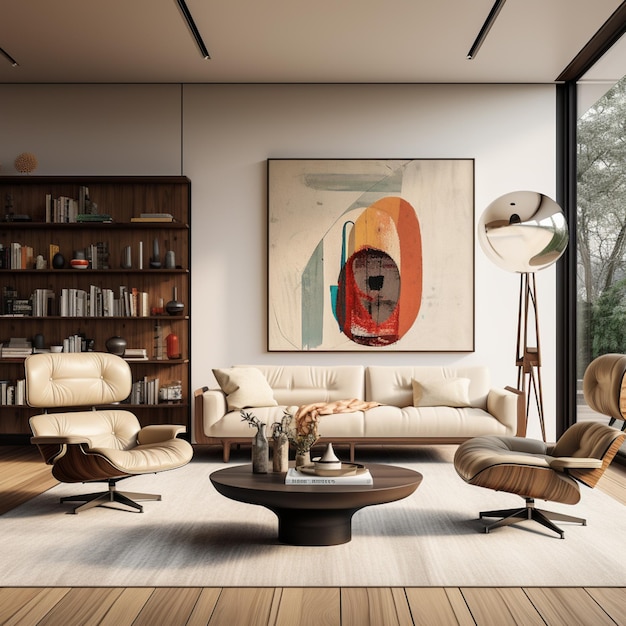
The height and width of the screenshot is (626, 626). I want to click on couch, so click(392, 404).